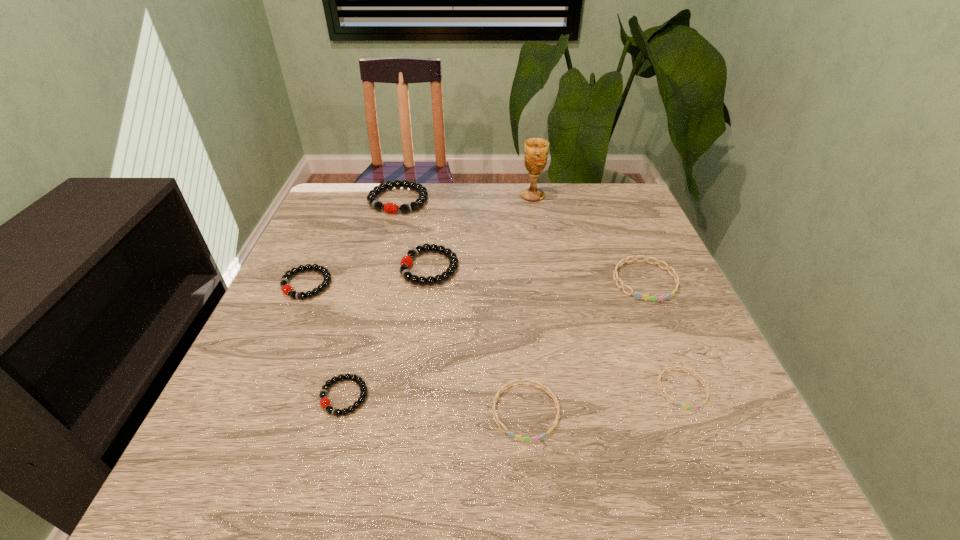
Find the location of a particular element. chalice that is at the far edge is located at coordinates (536, 150).

Identify the location of bracelet at the far edge. (392, 208).

The image size is (960, 540). I want to click on object situated at the far left corner, so click(x=392, y=208).

Locate an element on the screen. vacant area at the far edge is located at coordinates (563, 194).

Locate an element on the screen. blank space at the left edge of the desktop is located at coordinates (323, 302).

The width and height of the screenshot is (960, 540). Find the location of `free spot at the far left corner of the desktop`. free spot at the far left corner of the desktop is located at coordinates (318, 216).

At what (x,y) coordinates should I click in order to perform the action: click on vacant space at the near left corner of the desktop. Please return your answer as a coordinate pair (x, y). This screenshot has width=960, height=540. Looking at the image, I should click on (276, 463).

In order to click on free location at the near right corner in this screenshot , I will do `click(690, 475)`.

Find the location of a particular element. free space between the smallest black bracelet and the smallest blue bracelet is located at coordinates (513, 393).

Where is `empty location between the second biggest black bracelet and the second smallest black bracelet`? The image size is (960, 540). empty location between the second biggest black bracelet and the second smallest black bracelet is located at coordinates (369, 276).